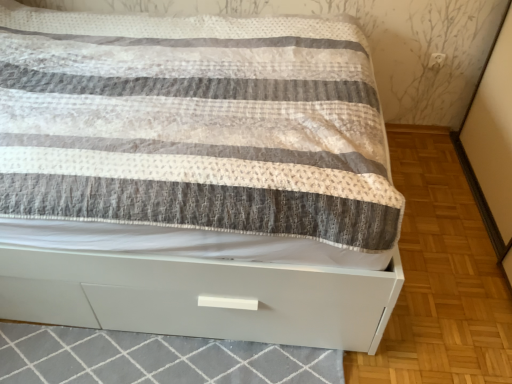
I want to click on vacant space in white glossy drawer at lower center (from a real-world perspective), so click(x=127, y=365).